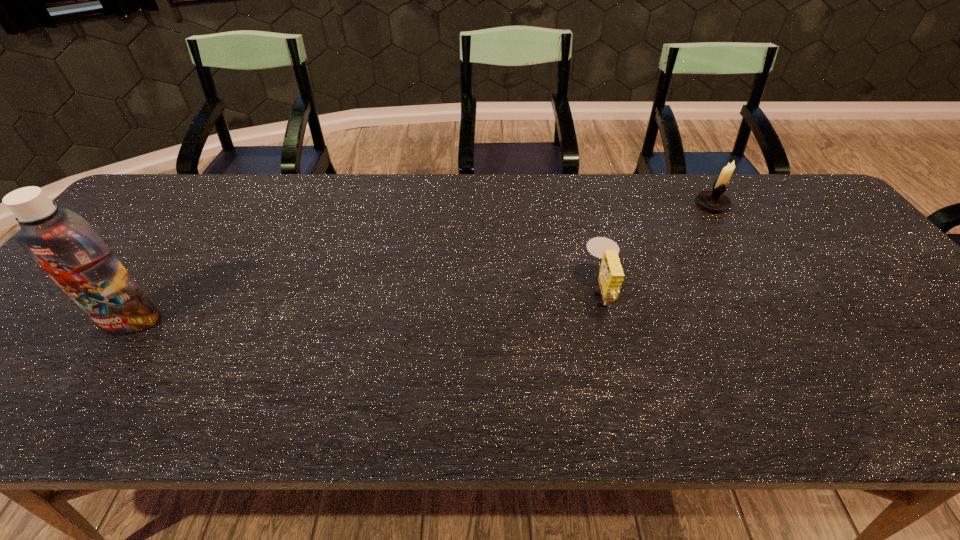
Locate an element on the screen. free location that satisfies the following two spatial constraints: 1. on the front-facing side of the sponge; 2. on the front label of the leftmost object is located at coordinates (609, 321).

Locate an element on the screen. This screenshot has width=960, height=540. free space that satisfies the following two spatial constraints: 1. on the front-facing side of the second object from right to left; 2. on the front label of the shampoo is located at coordinates point(609,321).